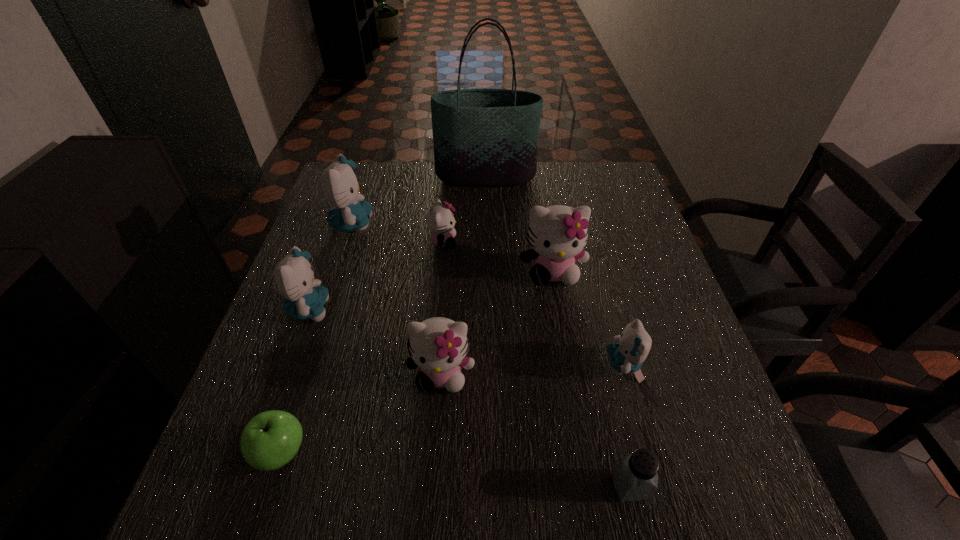
Where is `white kitten that is the third nearest to the apple`? The image size is (960, 540). white kitten that is the third nearest to the apple is located at coordinates (558, 234).

Locate an element on the screen. blank area in the image that satisfies the following two spatial constraints: 1. on the face of the biggest blue kitten; 2. on the left side of the saltshaker is located at coordinates (267, 487).

This screenshot has height=540, width=960. Identify the location of vacant space that satisfies the following two spatial constraints: 1. on the front-facing side of the rightmost white kitten; 2. on the left side of the saltshaker. (588, 487).

Locate an element on the screen. vacant space that satisfies the following two spatial constraints: 1. on the face of the green apple; 2. on the right side of the farthest blue kitten is located at coordinates (277, 453).